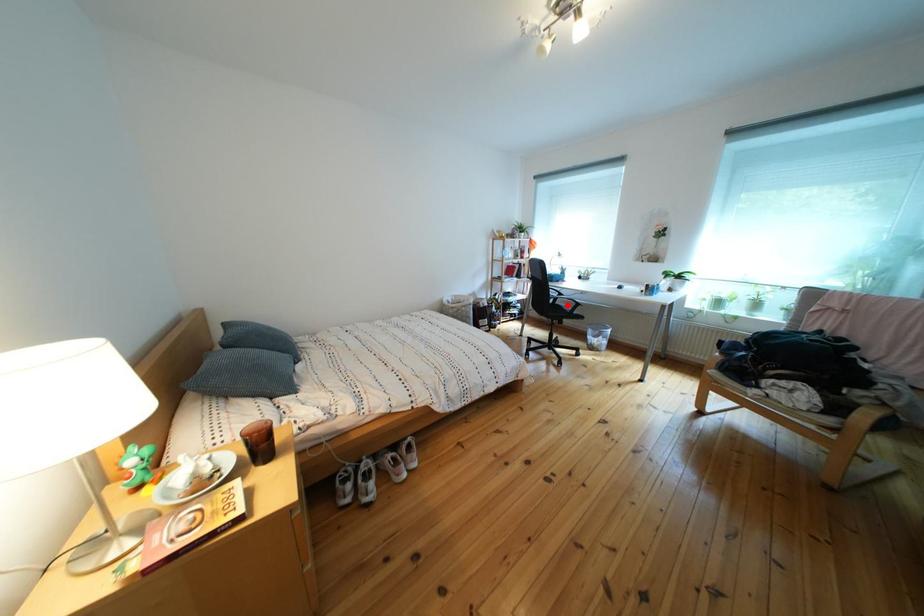
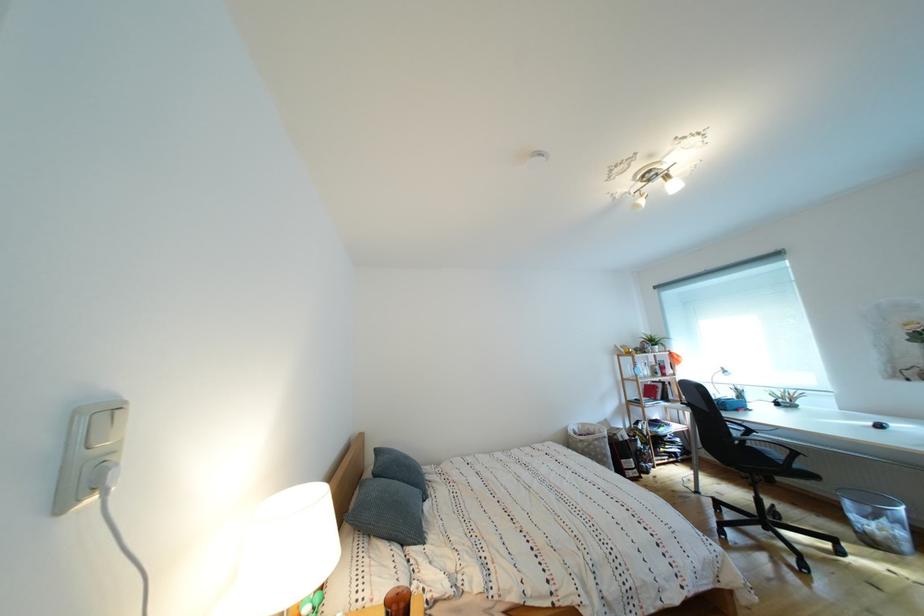
Question: I am providing you with two images of the same scene from different viewpoints. In image1, a red point is highlighted. Considering the same 3D point in image2, which of the following is correct?

Choices:
 (A) It is closer
 (B) It is farther

Answer: (B)